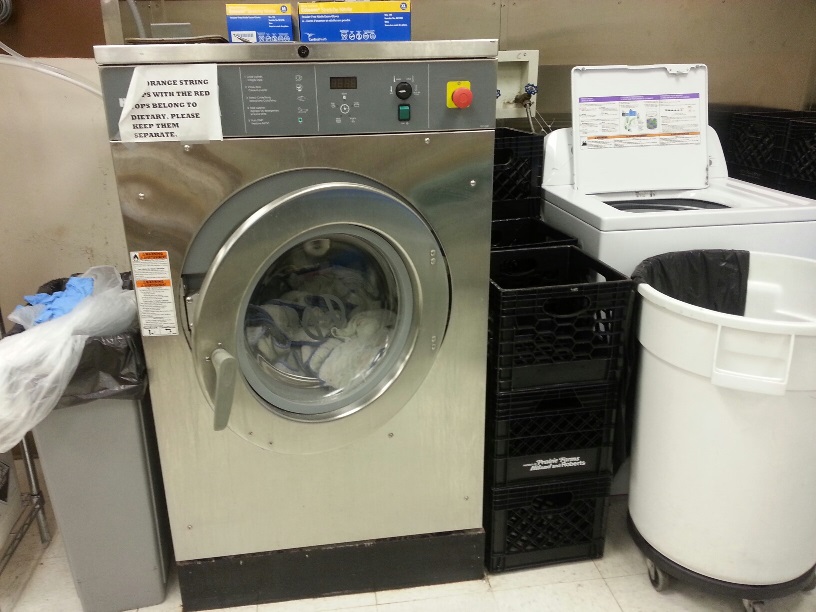
The width and height of the screenshot is (816, 612). In order to click on black milk crate in this screenshot , I will do `click(530, 351)`, `click(547, 455)`, `click(547, 493)`.